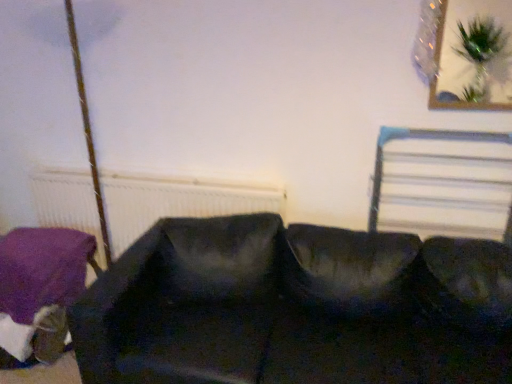
Question: Is white textured radiator at left positioned beyond the bounds of black fabric couch at center?

Choices:
 (A) yes
 (B) no

Answer: (A)

Question: Can you confirm if white textured radiator at left is bigger than black fabric couch at center?

Choices:
 (A) no
 (B) yes

Answer: (A)

Question: Can you confirm if white textured radiator at left is smaller than black fabric couch at center?

Choices:
 (A) no
 (B) yes

Answer: (B)

Question: Does white textured radiator at left appear on the left side of black fabric couch at center?

Choices:
 (A) no
 (B) yes

Answer: (B)

Question: From the image's perspective, is white textured radiator at left beneath black fabric couch at center?

Choices:
 (A) yes
 (B) no

Answer: (B)

Question: Considering the relative positions of white textured radiator at left and black fabric couch at center in the image provided, is white textured radiator at left to the right of black fabric couch at center from the viewer's perspective?

Choices:
 (A) no
 (B) yes

Answer: (A)

Question: Does white textured radiator at left lie behind metallic silver bed frame at upper right?

Choices:
 (A) no
 (B) yes

Answer: (B)

Question: Is white textured radiator at left smaller than metallic silver bed frame at upper right?

Choices:
 (A) yes
 (B) no

Answer: (B)

Question: Is white textured radiator at left bigger than metallic silver bed frame at upper right?

Choices:
 (A) yes
 (B) no

Answer: (A)

Question: Does white textured radiator at left touch metallic silver bed frame at upper right?

Choices:
 (A) no
 (B) yes

Answer: (A)

Question: Is white textured radiator at left closer to camera compared to metallic silver bed frame at upper right?

Choices:
 (A) yes
 (B) no

Answer: (B)

Question: From a real-world perspective, does white textured radiator at left sit lower than metallic silver bed frame at upper right?

Choices:
 (A) yes
 (B) no

Answer: (A)

Question: Considering the relative sizes of purple fabric cushion at lower left and white textured radiator at left in the image provided, is purple fabric cushion at lower left bigger than white textured radiator at left?

Choices:
 (A) no
 (B) yes

Answer: (B)